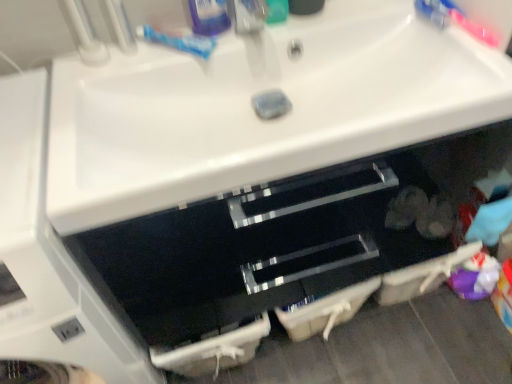
Question: Considering the relative sizes of green plastic toothpaste tube at upper center, the 1th toiletry in the right-to-left sequence, and blue matte toothpaste at upper center in the image provided, is green plastic toothpaste tube at upper center, the 1th toiletry in the right-to-left sequence, thinner than blue matte toothpaste at upper center?

Choices:
 (A) no
 (B) yes

Answer: (B)

Question: From a real-world perspective, is green plastic toothpaste tube at upper center, the 2th toiletry viewed from the left, physically above blue matte toothpaste at upper center?

Choices:
 (A) yes
 (B) no

Answer: (A)

Question: Considering the relative positions of green plastic toothpaste tube at upper center, the 2th toiletry viewed from the left, and blue matte toothpaste at upper center in the image provided, is green plastic toothpaste tube at upper center, the 2th toiletry viewed from the left, to the left of blue matte toothpaste at upper center from the viewer's perspective?

Choices:
 (A) no
 (B) yes

Answer: (A)

Question: Does green plastic toothpaste tube at upper center, the 2th toiletry viewed from the left, have a lesser height compared to blue matte toothpaste at upper center?

Choices:
 (A) no
 (B) yes

Answer: (A)

Question: Is blue matte toothpaste at upper center surrounded by green plastic toothpaste tube at upper center, the 1th toiletry in the right-to-left sequence?

Choices:
 (A) yes
 (B) no

Answer: (B)

Question: Would you consider green plastic toothpaste tube at upper center, the 1th toiletry in the right-to-left sequence, to be distant from blue matte toothpaste at upper center?

Choices:
 (A) yes
 (B) no

Answer: (B)

Question: From the image's perspective, is green plastic toothpaste tube at upper center, the 2th toiletry viewed from the left, located beneath white glossy sink at center?

Choices:
 (A) yes
 (B) no

Answer: (B)

Question: From the image's perspective, is green plastic toothpaste tube at upper center, the 1th toiletry in the right-to-left sequence, on top of white glossy sink at center?

Choices:
 (A) yes
 (B) no

Answer: (A)

Question: Does green plastic toothpaste tube at upper center, the 1th toiletry in the right-to-left sequence, have a greater width compared to white glossy sink at center?

Choices:
 (A) no
 (B) yes

Answer: (A)

Question: Considering the relative sizes of green plastic toothpaste tube at upper center, the 2th toiletry viewed from the left, and white glossy sink at center in the image provided, is green plastic toothpaste tube at upper center, the 2th toiletry viewed from the left, thinner than white glossy sink at center?

Choices:
 (A) no
 (B) yes

Answer: (B)

Question: Could you tell me if green plastic toothpaste tube at upper center, the 1th toiletry in the right-to-left sequence, is facing white glossy sink at center?

Choices:
 (A) no
 (B) yes

Answer: (A)

Question: Is green plastic toothpaste tube at upper center, the 2th toiletry viewed from the left, at the left side of white glossy sink at center?

Choices:
 (A) yes
 (B) no

Answer: (B)

Question: From the image's perspective, is blue matte toothpaste at upper center on matte plastic faucet at upper center?

Choices:
 (A) yes
 (B) no

Answer: (B)